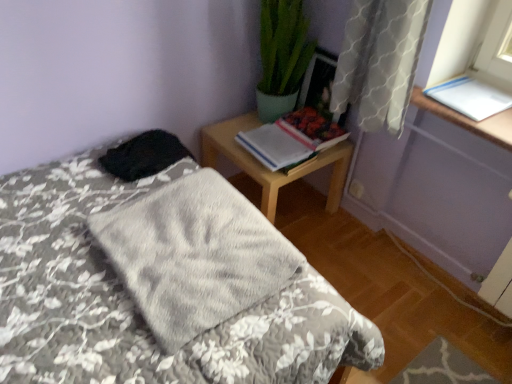
Question: From a real-world perspective, is hardcover book at upper right, arranged as the second book when viewed from the left, over fluffy gray blanket at center?

Choices:
 (A) yes
 (B) no

Answer: (A)

Question: Does hardcover book at upper right, arranged as the second book when viewed from the left, lie behind fluffy gray blanket at center?

Choices:
 (A) yes
 (B) no

Answer: (A)

Question: From the image's perspective, is hardcover book at upper right, arranged as the second book when viewed from the left, above fluffy gray blanket at center?

Choices:
 (A) no
 (B) yes

Answer: (B)

Question: Does hardcover book at upper right, arranged as the second book when viewed from the left, have a larger size compared to fluffy gray blanket at center?

Choices:
 (A) yes
 (B) no

Answer: (B)

Question: Is hardcover book at upper right, arranged as the second book when viewed from the left, at the right side of fluffy gray blanket at center?

Choices:
 (A) yes
 (B) no

Answer: (A)

Question: Is hardcover book at upper right, arranged as the second book when viewed from the left, far away from fluffy gray blanket at center?

Choices:
 (A) no
 (B) yes

Answer: (A)

Question: From a real-world perspective, is hardcover book at upper right, arranged as the 3th book when viewed from the right, below fluffy gray blanket at center?

Choices:
 (A) no
 (B) yes

Answer: (A)

Question: Are hardcover book at upper right, arranged as the 3th book when viewed from the right, and fluffy gray blanket at center located far from each other?

Choices:
 (A) no
 (B) yes

Answer: (A)

Question: Is hardcover book at upper right, arranged as the 3th book when viewed from the right, closer to the viewer compared to fluffy gray blanket at center?

Choices:
 (A) no
 (B) yes

Answer: (A)

Question: Considering the relative sizes of hardcover book at upper right, the first book in the left-to-right sequence, and fluffy gray blanket at center in the image provided, is hardcover book at upper right, the first book in the left-to-right sequence, bigger than fluffy gray blanket at center?

Choices:
 (A) yes
 (B) no

Answer: (B)

Question: Considering the relative sizes of hardcover book at upper right, the first book in the left-to-right sequence, and fluffy gray blanket at center in the image provided, is hardcover book at upper right, the first book in the left-to-right sequence, taller than fluffy gray blanket at center?

Choices:
 (A) no
 (B) yes

Answer: (A)

Question: Would you say hardcover book at upper right, the first book in the left-to-right sequence, contains fluffy gray blanket at center?

Choices:
 (A) yes
 (B) no

Answer: (B)

Question: Can you confirm if wooden nightstand at upper right is taller than white paper at upper right, placed as the first book when sorted from right to left?

Choices:
 (A) yes
 (B) no

Answer: (A)